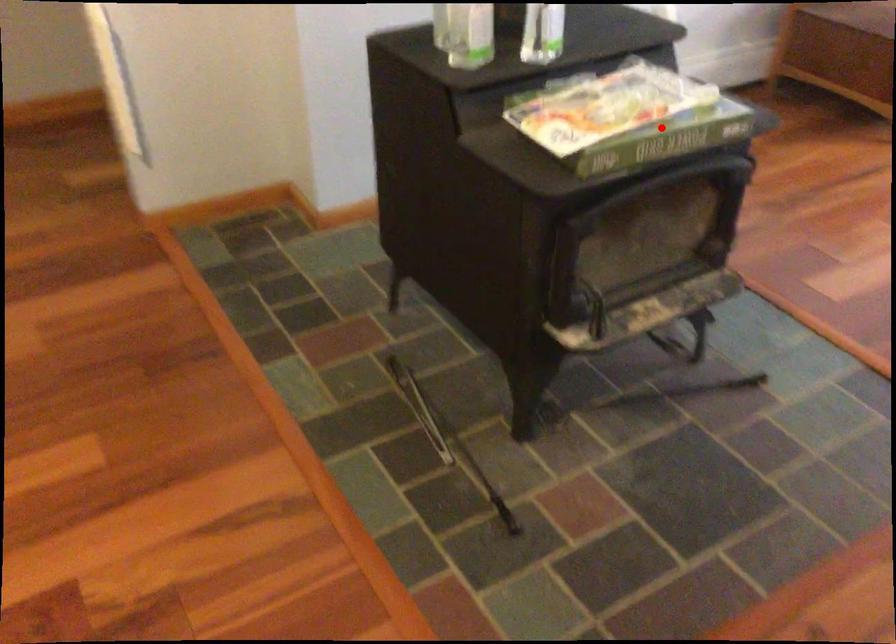
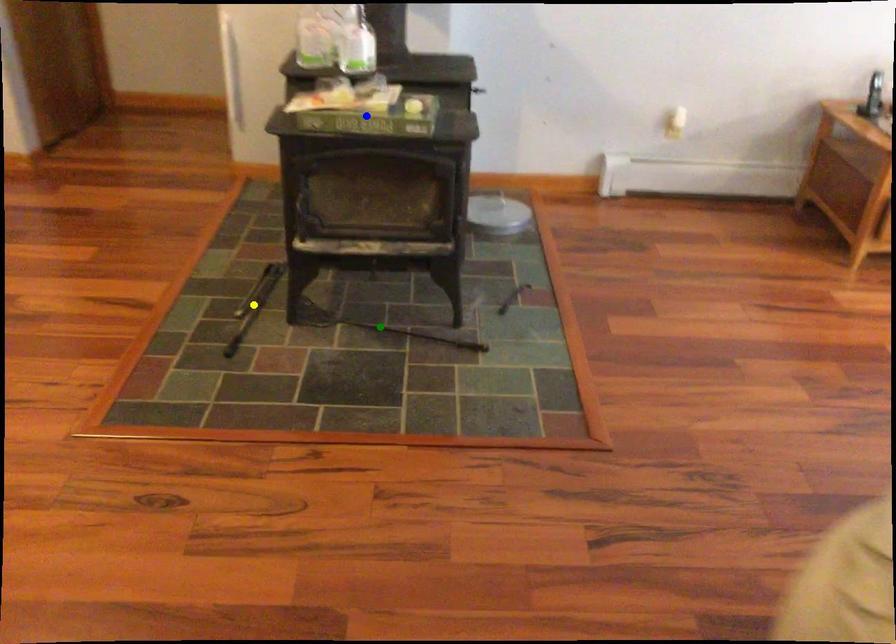
Question: I am providing you with two images of the same scene from different viewpoints. A red point is marked on the first image. You are given multiple points on the second image. Which point in image 2 represents the same 3d spot as the red point in image 1?

Choices:
 (A) blue point
 (B) yellow point
 (C) green point

Answer: (A)